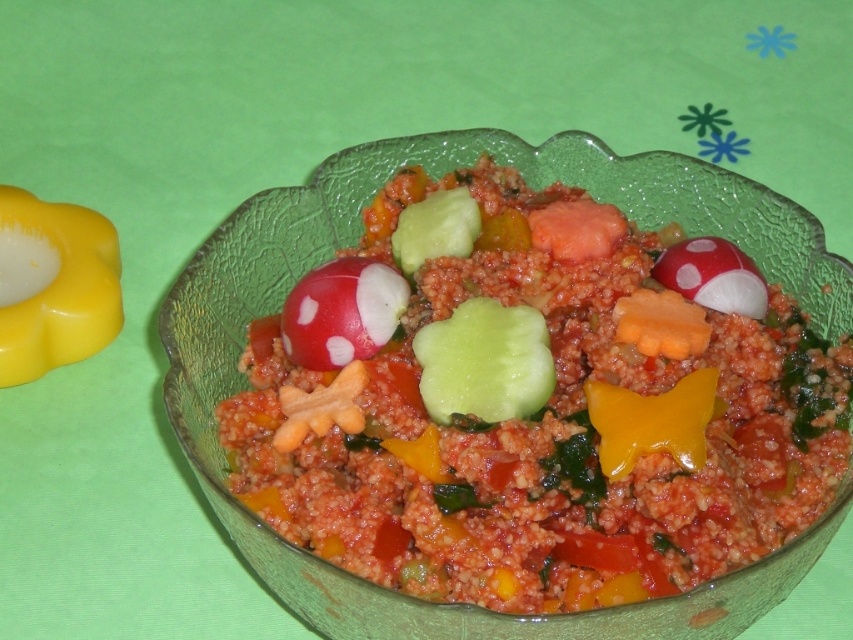
Question: Observing the image, what is the correct spatial positioning of smooth red radish at center in reference to green smooth cucumber at center?

Choices:
 (A) left
 (B) right

Answer: (B)

Question: Which object appears closest to the camera in this image?

Choices:
 (A) smooth red radish at center
 (B) green smooth cucumber at center

Answer: (A)

Question: Does smooth red radish at center have a larger size compared to green smooth cucumber at center?

Choices:
 (A) yes
 (B) no

Answer: (A)

Question: Which object is closer to the camera taking this photo?

Choices:
 (A) green smooth cucumber at center
 (B) smooth red radish at center

Answer: (B)

Question: Observing the image, what is the correct spatial positioning of smooth red radish at center in reference to green smooth cucumber at center?

Choices:
 (A) below
 (B) above

Answer: (B)

Question: Which point is farther from the camera taking this photo?

Choices:
 (A) (469, 336)
 (B) (492, 515)

Answer: (A)